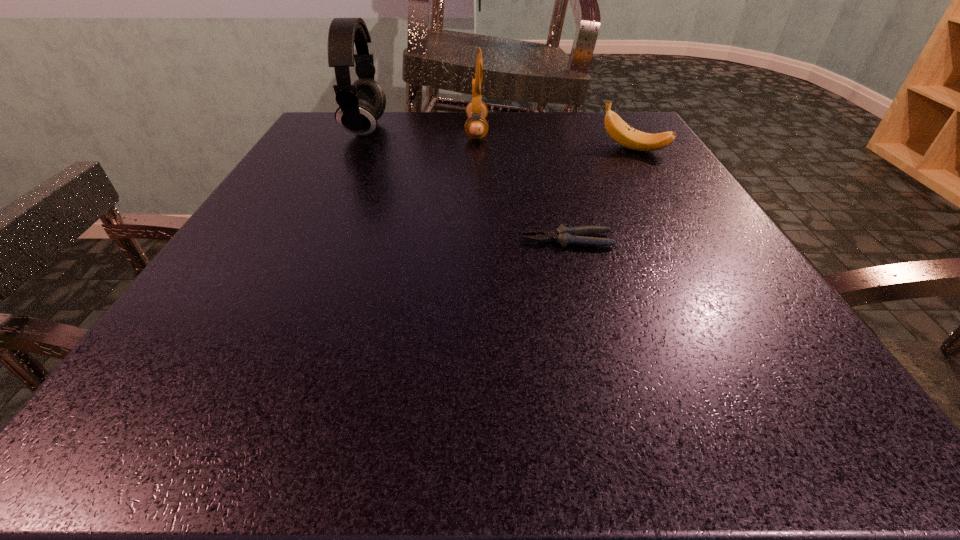
Locate an element on the screen. free space between the third object from right to left and the banana is located at coordinates (555, 140).

This screenshot has width=960, height=540. I want to click on free space between the pliers and the taller earphone, so click(467, 185).

You are a GUI agent. You are given a task and a screenshot of the screen. Output one action in this format:
    pyautogui.click(x=<x>, y=<y>)
    Task: Click on the free point between the banana and the shortest object
    This screenshot has height=540, width=960.
    Given the screenshot: What is the action you would take?
    pyautogui.click(x=600, y=194)

Where is `free space between the leftmost object and the second object from left to right`? Image resolution: width=960 pixels, height=540 pixels. free space between the leftmost object and the second object from left to right is located at coordinates (420, 130).

Locate an element on the screen. This screenshot has width=960, height=540. vacant area between the shorter earphone and the third tallest object is located at coordinates (555, 140).

Locate an element on the screen. blank region between the banana and the third shortest object is located at coordinates point(555,140).

At what (x,y) coordinates should I click in order to perform the action: click on object that is the closest to the rightmost object. Please return your answer as a coordinate pair (x, y). This screenshot has height=540, width=960. Looking at the image, I should click on (476, 127).

Select which object appears as the second closest to the pliers. Please provide its 2D coordinates. Your answer should be formatted as a tuple, i.e. [(x, y)], where the tuple contains the x and y coordinates of a point satisfying the conditions above.

[(476, 127)]

You are a GUI agent. You are given a task and a screenshot of the screen. Output one action in this format:
    pyautogui.click(x=<x>, y=<y>)
    Task: Click on the free space that satisfies the following two spatial constraints: 1. on the ear cups of the second shortest object; 2. on the right side of the left earphone
    
    Given the screenshot: What is the action you would take?
    pyautogui.click(x=356, y=149)

Locate an element on the screen. free space that satisfies the following two spatial constraints: 1. on the front-facing side of the shorter earphone; 2. on the right side of the rightmost object is located at coordinates (476, 149).